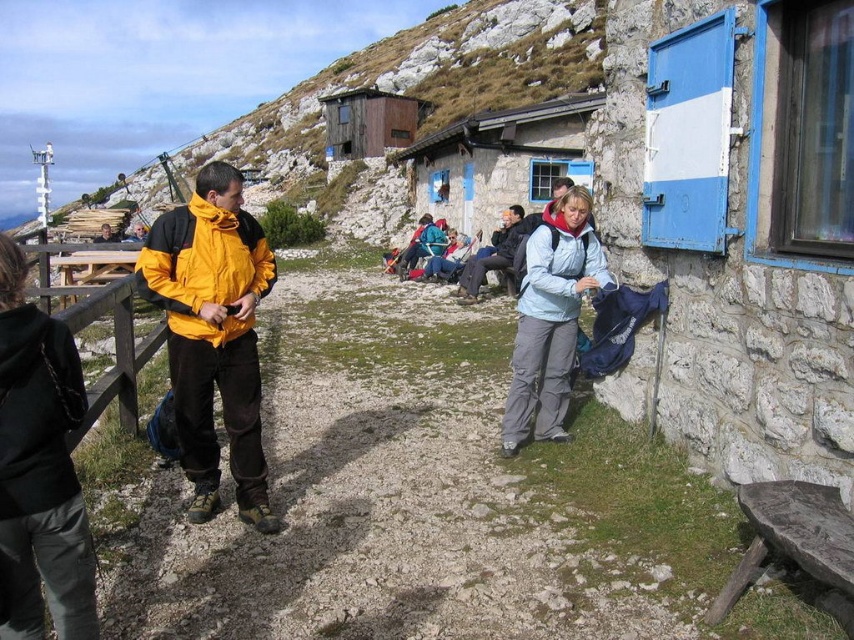
Can you confirm if brushed metal hut at upper center is shorter than light blue jacket at center?

No, brushed metal hut at upper center is not shorter than light blue jacket at center.

Does point (484, 67) come farther from viewer compared to point (518, 240)?

That is True.

Where is `brushed metal hut at upper center`? brushed metal hut at upper center is located at coordinates (414, 88).

Which is above, brushed metal hut at upper center or black leather jacket at left?

brushed metal hut at upper center is higher up.

Is brushed metal hut at upper center smaller than black leather jacket at left?

No, brushed metal hut at upper center is not smaller than black leather jacket at left.

The image size is (854, 640). I want to click on brushed metal hut at upper center, so click(x=414, y=88).

Between point (44, 525) and point (360, 124), which one is positioned in front?

Point (44, 525) is more forward.

Is point (67, 385) less distant than point (376, 128)?

Yes, it is.

Identify the location of black leather jacket at left. The width and height of the screenshot is (854, 640). (39, 467).